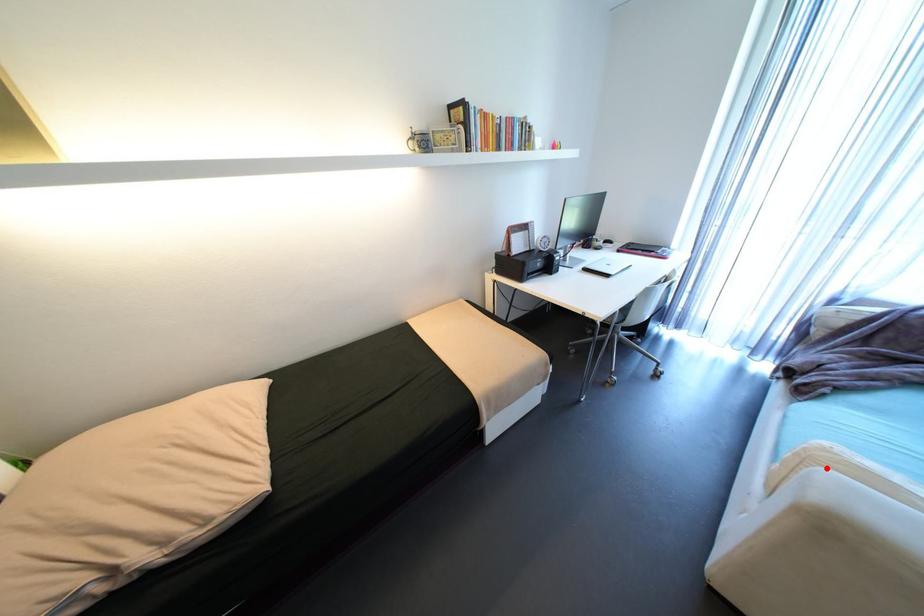
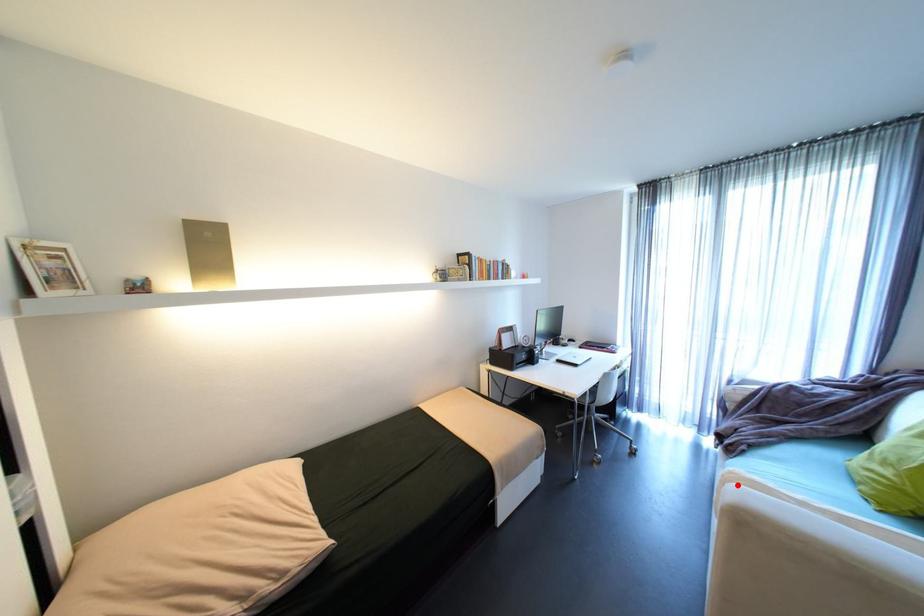
I am providing you with two images of the same scene from different viewpoints. A red point is marked on the first image and another point is marked on the second image. Do the highlighted points in image1 and image2 indicate the same real-world spot?

Yes